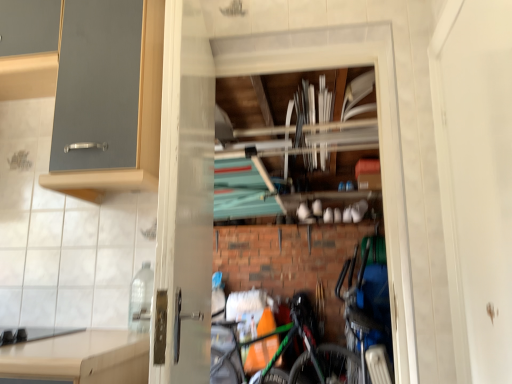
Question: Is blue metallic bicycle at lower right, positioned as the second bicycle in left-to-right order, facing away from green matte bicycle at center, which is the first bicycle from left to right?

Choices:
 (A) yes
 (B) no

Answer: (B)

Question: Does blue metallic bicycle at lower right, placed as the 1th bicycle when sorted from right to left, have a larger size compared to green matte bicycle at center, positioned as the 1th bicycle in front-to-back order?

Choices:
 (A) no
 (B) yes

Answer: (B)

Question: Is blue metallic bicycle at lower right, placed as the 1th bicycle when sorted from right to left, with green matte bicycle at center, positioned as the 1th bicycle in front-to-back order?

Choices:
 (A) yes
 (B) no

Answer: (B)

Question: From a real-world perspective, is blue metallic bicycle at lower right, the second bicycle in the front-to-back sequence, located higher than green matte bicycle at center, which is the first bicycle from left to right?

Choices:
 (A) yes
 (B) no

Answer: (B)

Question: Could you tell me if blue metallic bicycle at lower right, the 1th bicycle in the back-to-front sequence, is turned towards green matte bicycle at center, acting as the second bicycle starting from the right?

Choices:
 (A) yes
 (B) no

Answer: (B)

Question: Is transparent glass screen door at center, which is counted as the first screen door, starting from the left, bigger or smaller than matte gray cabinet at upper left?

Choices:
 (A) big
 (B) small

Answer: (B)

Question: From a real-world perspective, relative to matte gray cabinet at upper left, is transparent glass screen door at center, the second screen door from the right, vertically above or below?

Choices:
 (A) below
 (B) above

Answer: (A)

Question: Is transparent glass screen door at center, which is counted as the first screen door, starting from the left, situated inside matte gray cabinet at upper left or outside?

Choices:
 (A) outside
 (B) inside

Answer: (A)

Question: Would you say transparent glass screen door at center, the second screen door from the right, is to the left or to the right of matte gray cabinet at upper left in the picture?

Choices:
 (A) right
 (B) left

Answer: (A)

Question: Is blue metallic bicycle at lower right, positioned as the second bicycle in left-to-right order, wider or thinner than clear plastic bottle at lower left?

Choices:
 (A) thin
 (B) wide

Answer: (B)

Question: Visually, is blue metallic bicycle at lower right, the second bicycle in the front-to-back sequence, positioned to the left or to the right of clear plastic bottle at lower left?

Choices:
 (A) left
 (B) right

Answer: (B)

Question: In terms of size, does blue metallic bicycle at lower right, positioned as the second bicycle in left-to-right order, appear bigger or smaller than clear plastic bottle at lower left?

Choices:
 (A) big
 (B) small

Answer: (A)

Question: In terms of height, does blue metallic bicycle at lower right, the second bicycle in the front-to-back sequence, look taller or shorter compared to clear plastic bottle at lower left?

Choices:
 (A) tall
 (B) short

Answer: (A)

Question: Is black matte gas stove at lower left in front of or behind white matte screen door at right, which ranks as the second screen door in left-to-right order, in the image?

Choices:
 (A) behind
 (B) front

Answer: (A)

Question: Is black matte gas stove at lower left inside the boundaries of white matte screen door at right, which ranks as the second screen door in left-to-right order, or outside?

Choices:
 (A) outside
 (B) inside

Answer: (A)